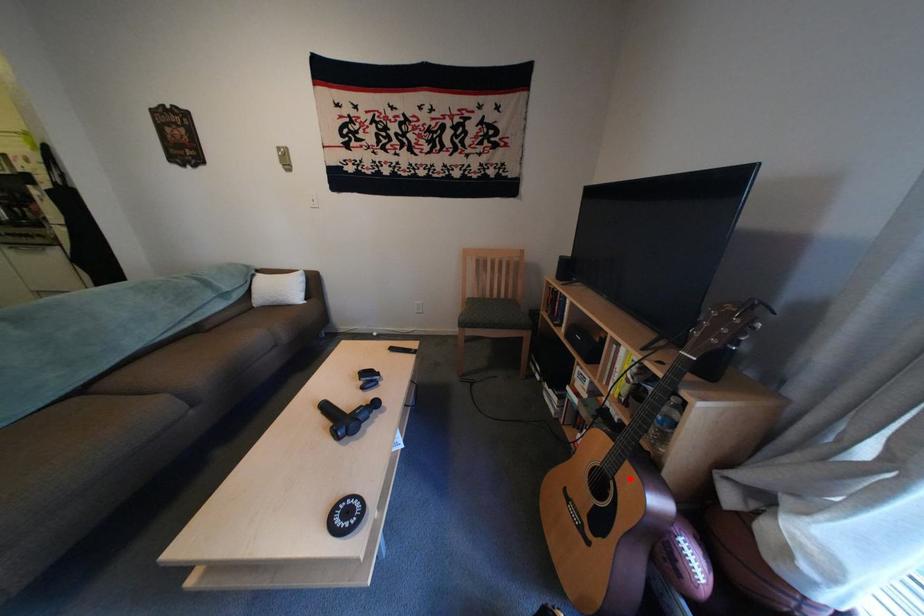
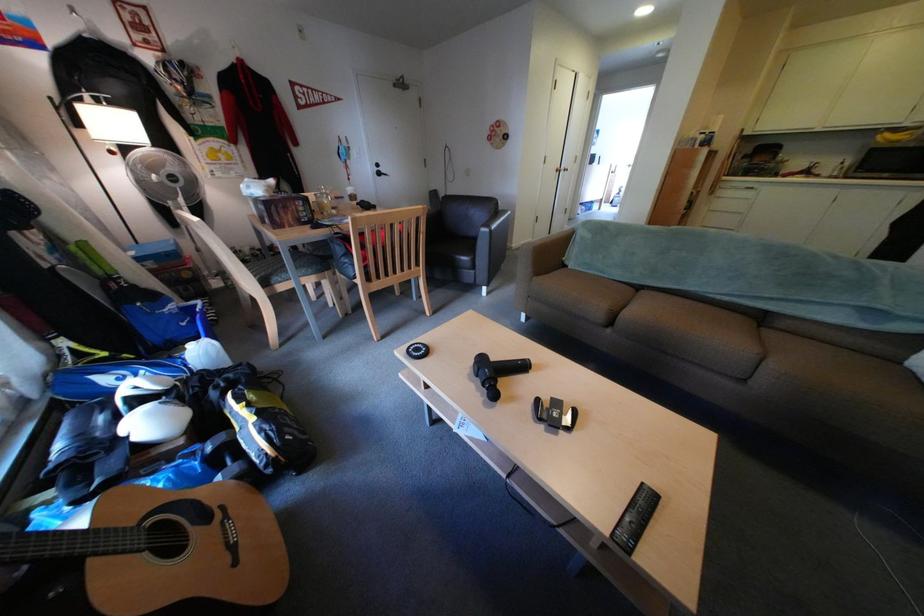
Where in the second image is the point corresponding to the highlighted location from the first image?

(148, 527)